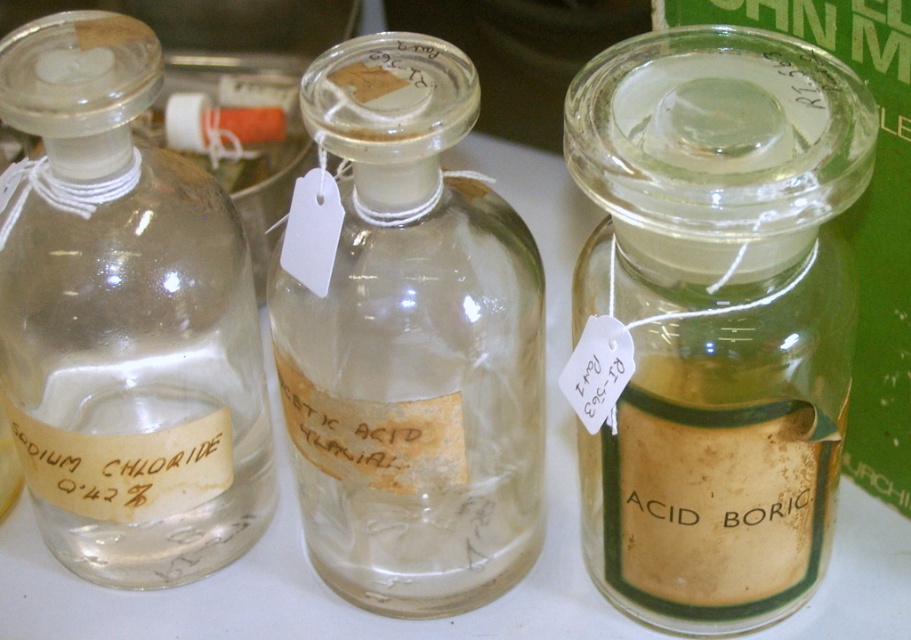
Question: Which point is closer to the camera?

Choices:
 (A) transparent glass jar at center
 (B) transparent glass bottle at left

Answer: (A)

Question: Which point is closer to the camera?

Choices:
 (A) (645, 186)
 (B) (303, 205)
 (C) (41, 76)

Answer: (A)

Question: Is transparent glass jar at center closer to the viewer compared to transparent glass bottle at left?

Choices:
 (A) yes
 (B) no

Answer: (A)

Question: Does transparent glass jar at center lie in front of transparent glass bottle at center?

Choices:
 (A) yes
 (B) no

Answer: (A)

Question: Among these points, which one is farthest from the camera?

Choices:
 (A) (708, 221)
 (B) (350, 596)
 (C) (234, 257)

Answer: (B)

Question: From the image, what is the correct spatial relationship of transparent glass bottle at center in relation to transparent glass bottle at left?

Choices:
 (A) above
 (B) below

Answer: (A)